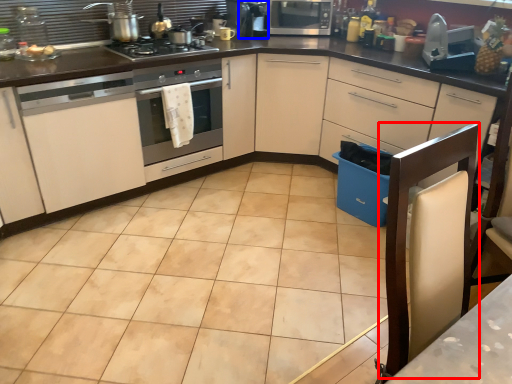
Question: Which object is closer to the camera taking this photo, chair (highlighted by a red box) or appliance (highlighted by a blue box)?

Choices:
 (A) chair
 (B) appliance

Answer: (A)